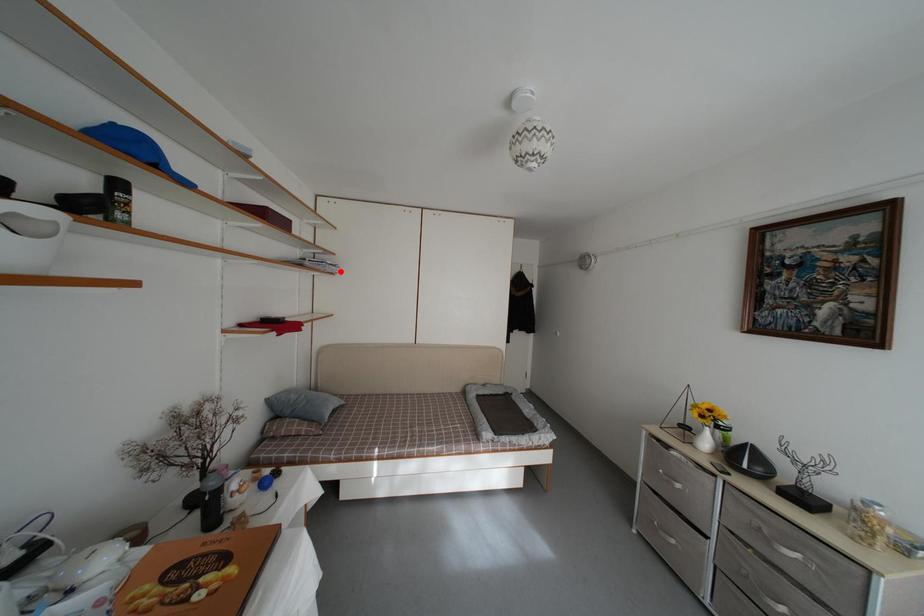
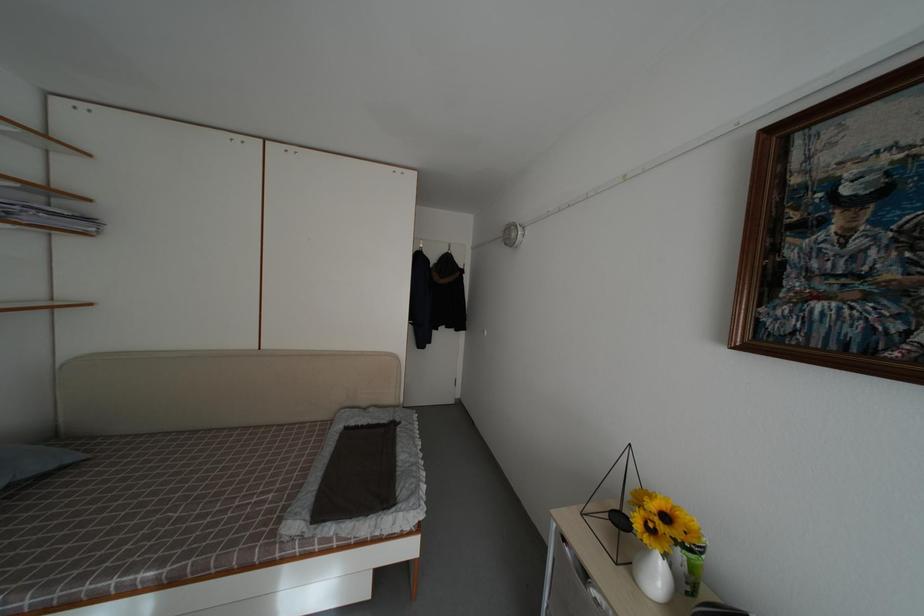
Question: I am providing you with two images of the same scene from different viewpoints. A red point is marked on the first image. Is the red point's position out of view in image 2?

Choices:
 (A) Yes
 (B) No

Answer: (B)